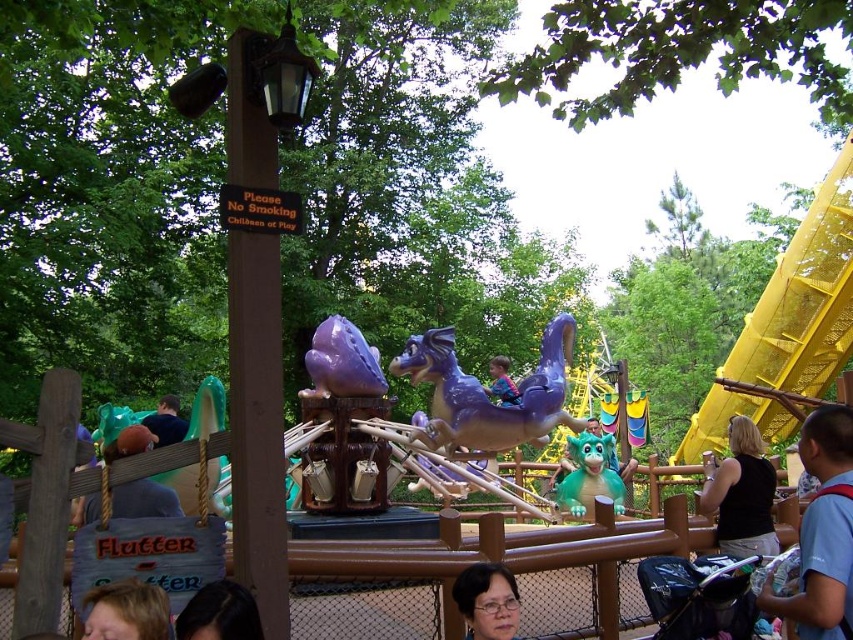
Question: Which of the following is the closest to the observer?

Choices:
 (A) blonde hair at lower left
 (B) dark brown hair at lower left
 (C) matte black glasses at lower center
 (D) black fabric stroller at lower right

Answer: (A)

Question: Can you confirm if black fabric stroller at lower right is smaller than dark brown hair at lower left?

Choices:
 (A) no
 (B) yes

Answer: (A)

Question: Is blonde hair at lower left further to camera compared to matte black glasses at lower center?

Choices:
 (A) yes
 (B) no

Answer: (B)

Question: Which object is positioned closest to the blonde hair at lower left?

Choices:
 (A) purple plastic dragon at center
 (B) black fabric stroller at lower right
 (C) yellow metallic slide at right

Answer: (B)

Question: Based on their relative distances, which object is nearer to the purple plastic dragon at center?

Choices:
 (A) brown plush toy at left
 (B) blue shirt at lower right
 (C) blonde hair at lower left

Answer: (A)

Question: Does blue shirt at lower right appear under dark blue shirt at lower left?

Choices:
 (A) yes
 (B) no

Answer: (A)